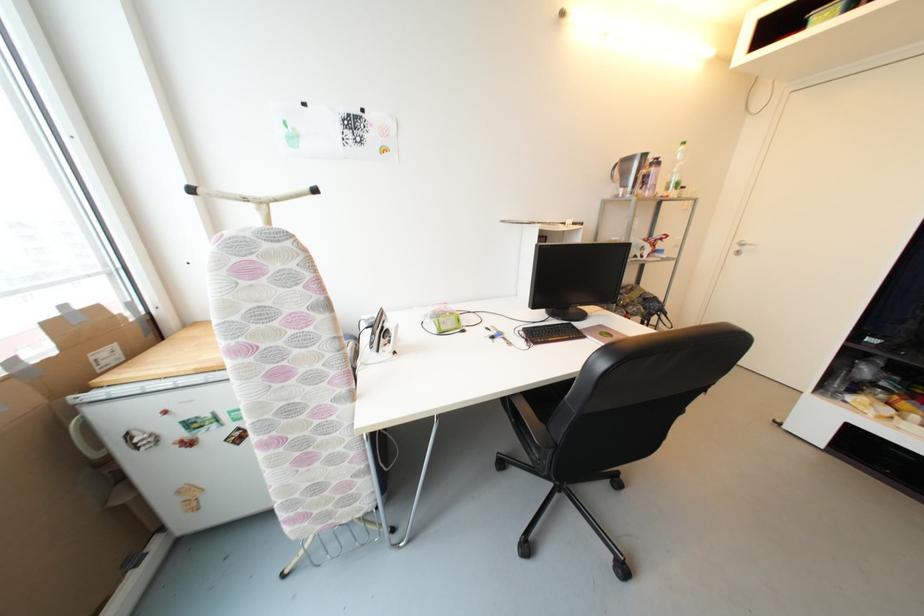
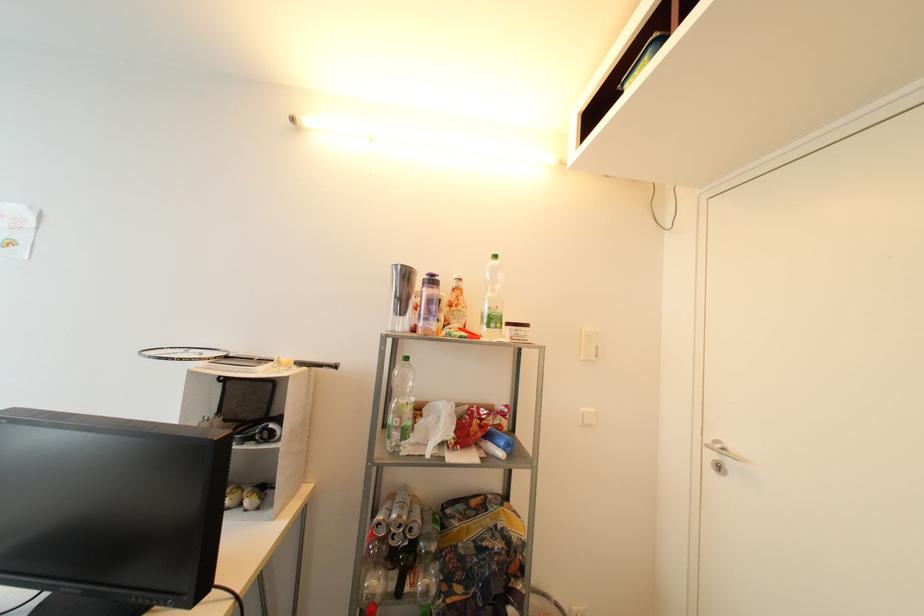
The point at (661, 164) is marked in the first image. Where is the corresponding point in the second image?

(438, 283)